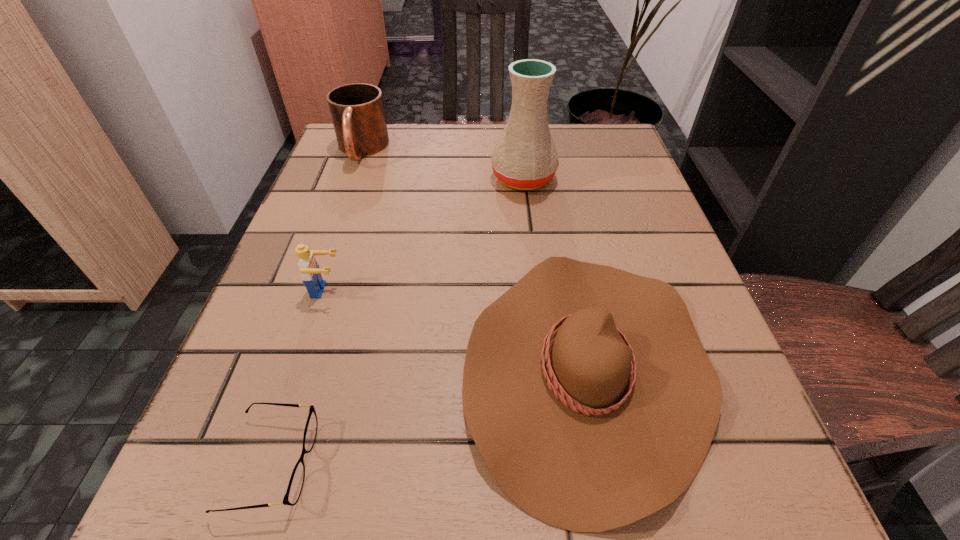
Find the location of a particular element. The width and height of the screenshot is (960, 540). pottery at the far edge is located at coordinates (525, 157).

The width and height of the screenshot is (960, 540). I want to click on mug that is positioned at the far edge, so click(357, 111).

This screenshot has width=960, height=540. I want to click on cowboy hat that is positioned at the near edge, so click(586, 389).

Locate an element on the screen. Image resolution: width=960 pixels, height=540 pixels. spectacles present at the near edge is located at coordinates (296, 482).

This screenshot has width=960, height=540. Identify the location of mug that is at the left edge. (357, 111).

At what (x,y) coordinates should I click in order to perform the action: click on Lego situated at the left edge. Please return your answer as a coordinate pair (x, y). The height and width of the screenshot is (540, 960). Looking at the image, I should click on (310, 271).

Where is `spectacles that is at the left edge`? spectacles that is at the left edge is located at coordinates (296, 482).

Where is `object at the right edge`? This screenshot has height=540, width=960. object at the right edge is located at coordinates (586, 389).

The image size is (960, 540). Identify the location of object positioned at the far left corner. (357, 111).

This screenshot has height=540, width=960. What are the coordinates of `object located in the near left corner section of the desktop` in the screenshot? It's located at (296, 482).